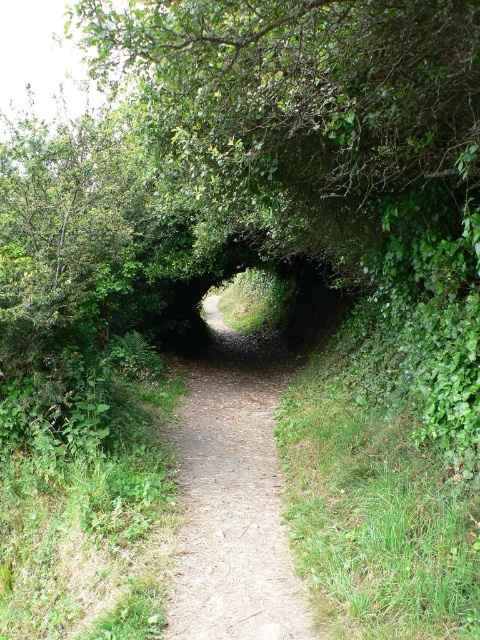
You are hiking through a forest and come across a natural tunnel formed by green leafy tree at center and dirt path at center. You need to decide whether to walk through the tunnel or go around it. Which option would allow you to stay on the trail more easily?

The dirt path at center is smaller than the green leafy tree at center, so staying on the trail would be easier by following the dirt path at center since it is the designated path.

You are a hiker standing at the entrance of the tunnel formed by the green leafy tree at center. You want to take a photo of the tree from exactly 10 feet away. Can you step forward or backward to achieve this?

The green leafy tree at center is currently 10.14 feet away, so stepping forward by approximately 0.14 feet would bring you to the desired 10 feet distance for the photo.

You are planning to drive a 2.5 meter wide truck through the dirt path at center. Considering the green leafy tree at center, will the truck fit through the path without hitting the tree?

The green leafy tree at center is wider than the dirt path at center. Since the truck is 2.5 meters wide, it may not fit through the path if the path is narrower than the truck. However, the exact width of the path isn